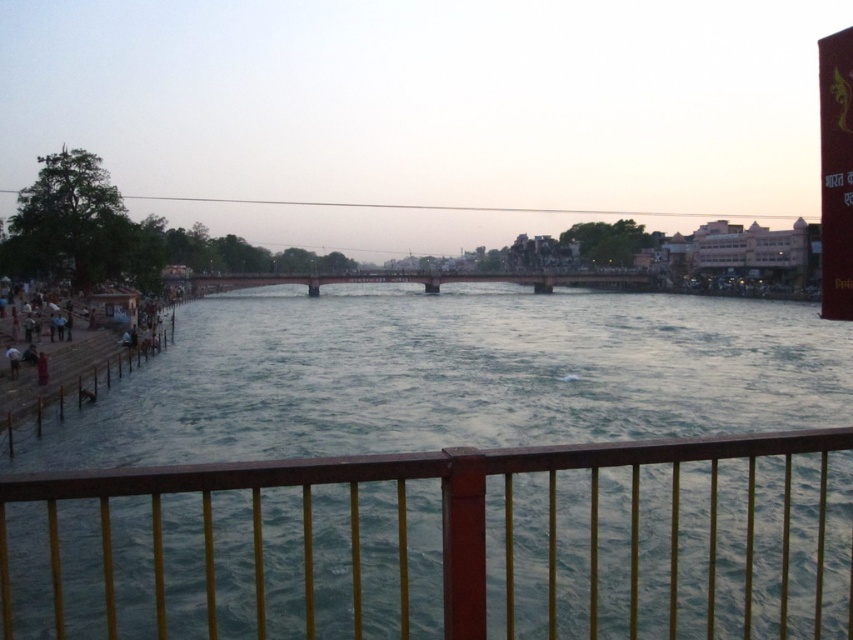
Question: Is brown wooden fence at lower center behind wooden dock at lower left?

Choices:
 (A) yes
 (B) no

Answer: (B)

Question: Which is farther from the brown wooden fence at lower center?

Choices:
 (A) wooden dock at lower left
 (B) dark blue fabric person at lower left

Answer: (B)

Question: Which point is farther from the camera taking this photo?

Choices:
 (A) (450, 605)
 (B) (15, 358)

Answer: (B)

Question: Can you confirm if brown wooden fence at lower center is smaller than metallic bridge at center?

Choices:
 (A) no
 (B) yes

Answer: (B)

Question: Is brown wooden fence at lower center to the right of dark blue fabric person at lower left from the viewer's perspective?

Choices:
 (A) no
 (B) yes

Answer: (B)

Question: Which object appears farthest from the camera in this image?

Choices:
 (A) red plastic sign at upper right
 (B) wooden dock at lower left
 (C) metallic bridge at center
 (D) brown wooden fence at lower center

Answer: (C)